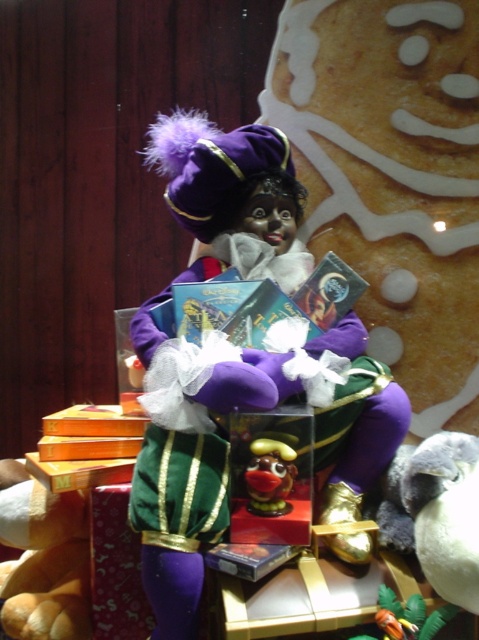
Between purple velvet doll at center and rubber duck at center, which one is positioned lower?

rubber duck at center

Which is in front, point (225, 161) or point (281, 512)?

Positioned in front is point (281, 512).

This screenshot has width=479, height=640. Find the location of `purple velvet doll at center`. purple velvet doll at center is located at coordinates (190, 461).

Looking at this image, can you confirm if white plush teddy bear at lower left is smaller than rubber duck at center?

No, white plush teddy bear at lower left is not smaller than rubber duck at center.

Find the location of `white plush teddy bear at lower left`. white plush teddy bear at lower left is located at coordinates (44, 560).

Who is lower down, purple velvet doll at center or white plush teddy bear at lower left?

white plush teddy bear at lower left

Can you confirm if purple velvet doll at center is wider than white plush teddy bear at lower left?

Yes, purple velvet doll at center is wider than white plush teddy bear at lower left.

Where is `purple velvet doll at center`? purple velvet doll at center is located at coordinates (190, 461).

The height and width of the screenshot is (640, 479). Find the location of `purple velvet doll at center`. purple velvet doll at center is located at coordinates (190, 461).